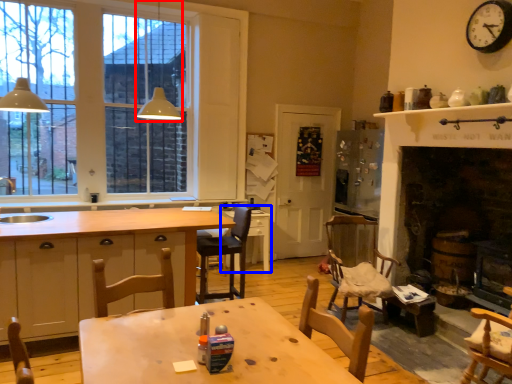
Question: Among these objects, which one is farthest to the camera, light fixture (highlighted by a red box) or table (highlighted by a blue box)?

Choices:
 (A) light fixture
 (B) table

Answer: (B)